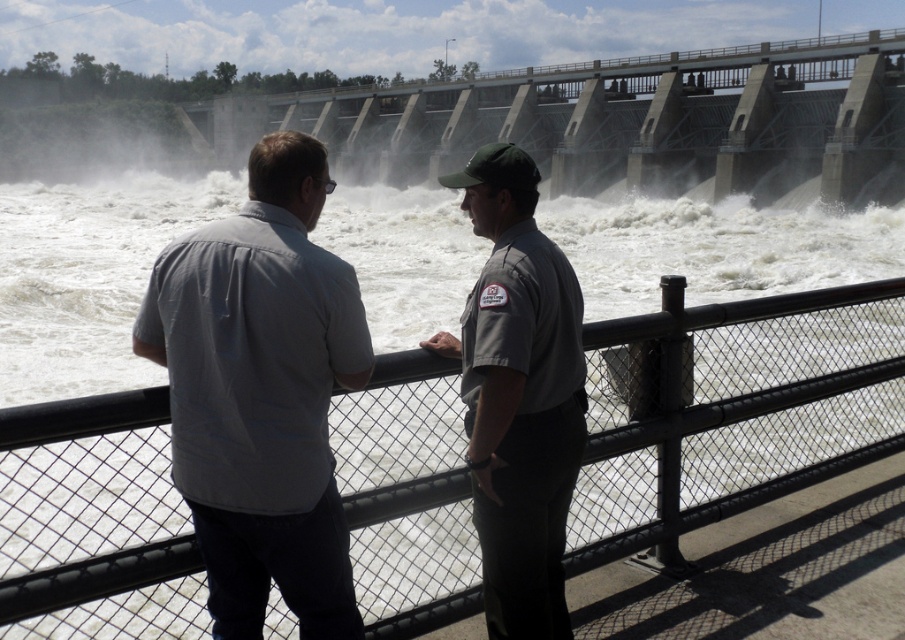
Which is behind, point (148, 349) or point (520, 314)?

Point (520, 314)

Who is more forward, (308, 163) or (500, 442)?

Point (308, 163) is in front.

At what (x,y) coordinates should I click in order to perform the action: click on gray cotton shirt at center. Please return your answer as a coordinate pair (x, y). This screenshot has height=640, width=905. Looking at the image, I should click on (262, 394).

At what (x,y) coordinates should I click in order to perform the action: click on gray cotton shirt at center. Please return your answer as a coordinate pair (x, y). Image resolution: width=905 pixels, height=640 pixels. Looking at the image, I should click on (262, 394).

Is concrete dam at center to the right of gray uniform at center from the viewer's perspective?

Incorrect, concrete dam at center is not on the right side of gray uniform at center.

Is point (502, 131) in front of point (535, 556)?

No, it is not.

Does point (706, 128) lie behind point (426, 348)?

Yes, it is behind point (426, 348).

Where is `concrete dam at center`? concrete dam at center is located at coordinates (615, 118).

How distant is black chain-link fence at center from concrete dam at center?

black chain-link fence at center is 46.95 meters from concrete dam at center.

The height and width of the screenshot is (640, 905). What do you see at coordinates (738, 408) in the screenshot?
I see `black chain-link fence at center` at bounding box center [738, 408].

Is point (25, 573) positioned after point (559, 150)?

No, (25, 573) is closer to viewer.

Locate an element on the screen. Image resolution: width=905 pixels, height=640 pixels. black chain-link fence at center is located at coordinates (738, 408).